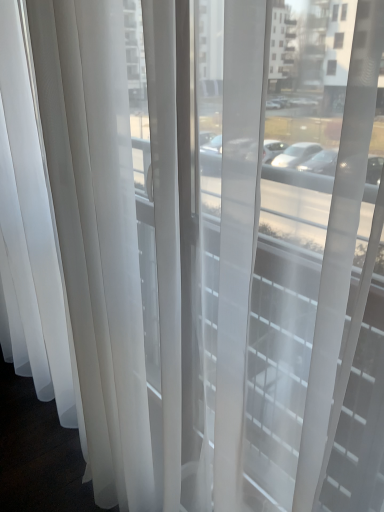
Identify the location of sheer white curtain at left. This screenshot has height=512, width=384. (98, 231).

Describe the element at coordinates (98, 231) in the screenshot. I see `sheer white curtain at left` at that location.

This screenshot has height=512, width=384. In order to click on sheer white curtain at left in this screenshot , I will do `click(98, 231)`.